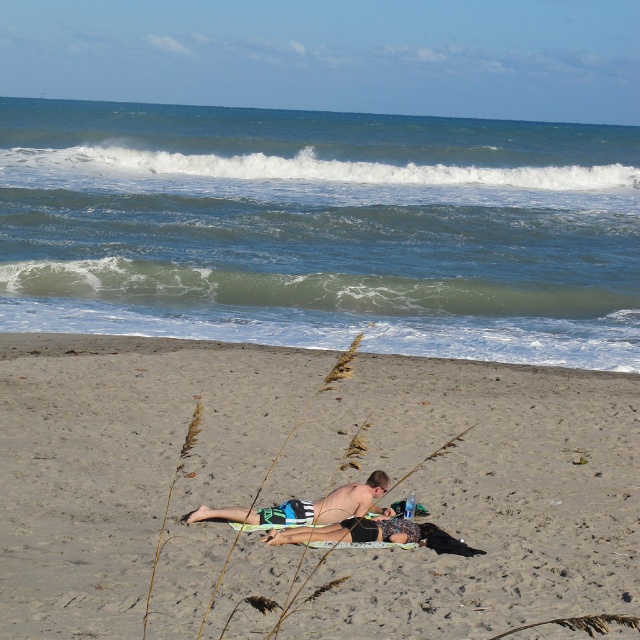
Question: Among these objects, which one is farthest from the camera?

Choices:
 (A) skinny tan man at center
 (B) sandy beach at lower center
 (C) printed fabric bikini at center
 (D) tan skin man at center

Answer: (A)

Question: Can you confirm if sandy beach at lower center is thinner than printed fabric bikini at center?

Choices:
 (A) no
 (B) yes

Answer: (A)

Question: Which point is closer to the camera?

Choices:
 (A) sandy beach at lower center
 (B) printed fabric bikini at center
 (C) skinny tan man at center
 (D) tan skin man at center

Answer: (A)

Question: Among these objects, which one is nearest to the camera?

Choices:
 (A) sandy beach at lower center
 (B) skinny tan man at center
 (C) printed fabric bikini at center

Answer: (A)

Question: Can you confirm if tan skin man at center is positioned to the right of skinny tan man at center?

Choices:
 (A) yes
 (B) no

Answer: (B)

Question: Is tan skin man at center closer to the viewer compared to skinny tan man at center?

Choices:
 (A) no
 (B) yes

Answer: (B)